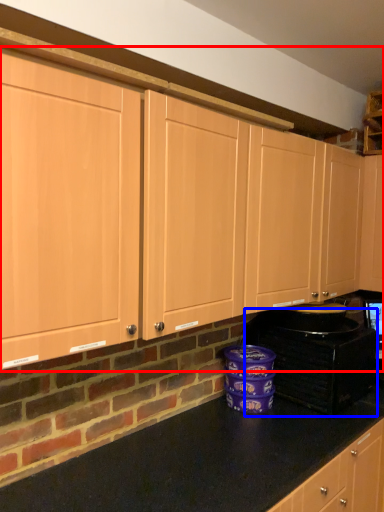
Question: Which of the following is the closest to the observer, cabinetry (highlighted by a red box) or home appliance (highlighted by a blue box)?

Choices:
 (A) cabinetry
 (B) home appliance

Answer: (A)